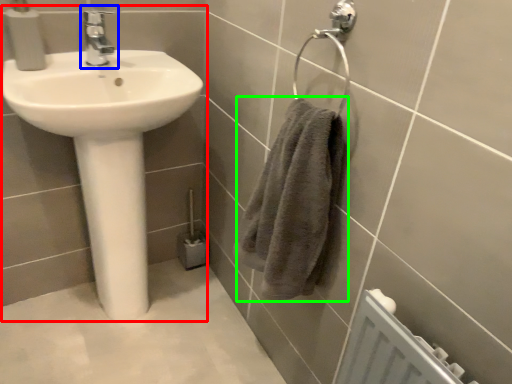
Question: Based on their relative distances, which object is nearer to sink (highlighted by a red box)? Choose from tap (highlighted by a blue box) and bath towel (highlighted by a green box).

Choices:
 (A) tap
 (B) bath towel

Answer: (A)